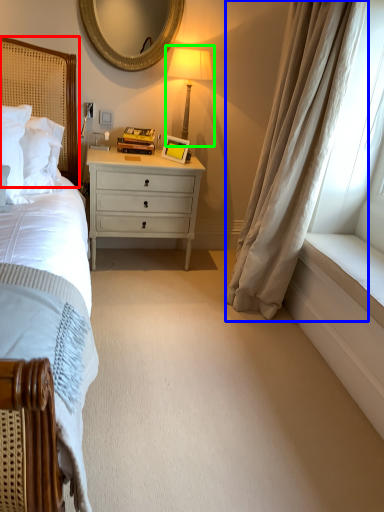
Question: Which object is positioned farthest from headboard (highlighted by a red box)? Select from curtain (highlighted by a blue box) and bedside lamp (highlighted by a green box).

Choices:
 (A) curtain
 (B) bedside lamp

Answer: (A)